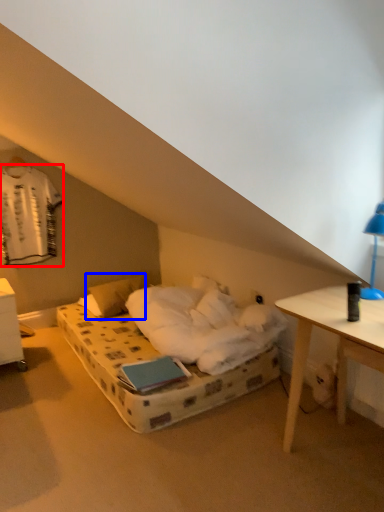
Question: Which of the following is the farthest to the observer, laundry (highlighted by a red box) or pillow (highlighted by a blue box)?

Choices:
 (A) laundry
 (B) pillow

Answer: (B)